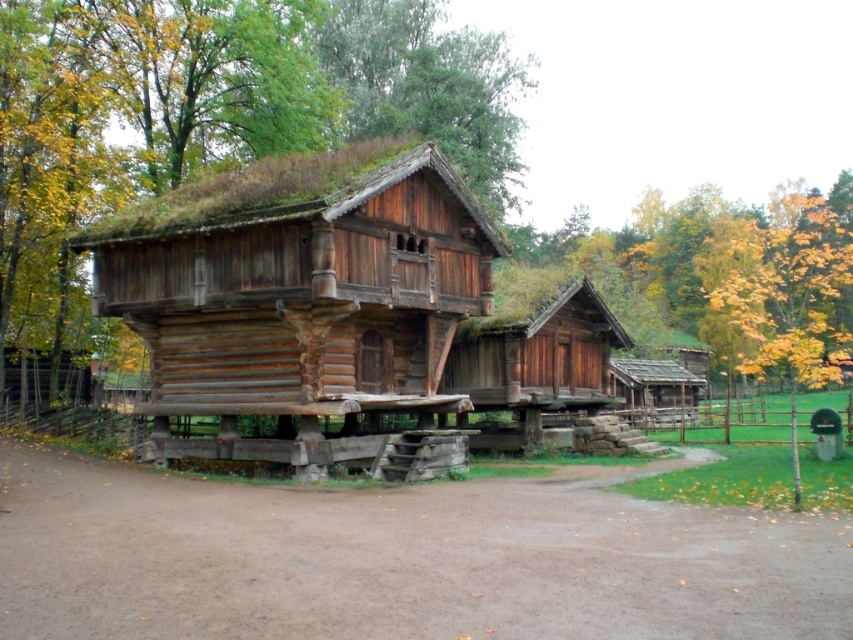
Measure the distance between green mossy roof at center and camera.

green mossy roof at center and camera are 15.46 meters apart.

Between green mossy roof at center and yellow-green leaves at upper right, which one appears on the left side from the viewer's perspective?

From the viewer's perspective, green mossy roof at center appears more on the left side.

The image size is (853, 640). I want to click on green mossy roof at center, so click(x=219, y=109).